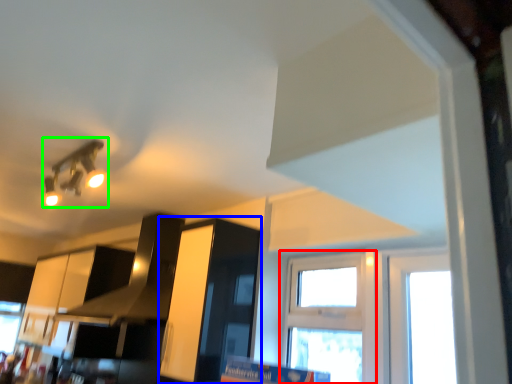
Question: Which object is positioned farthest from window (highlighted by a red box)? Select from cabinetry (highlighted by a blue box) and light fixture (highlighted by a green box).

Choices:
 (A) cabinetry
 (B) light fixture

Answer: (B)